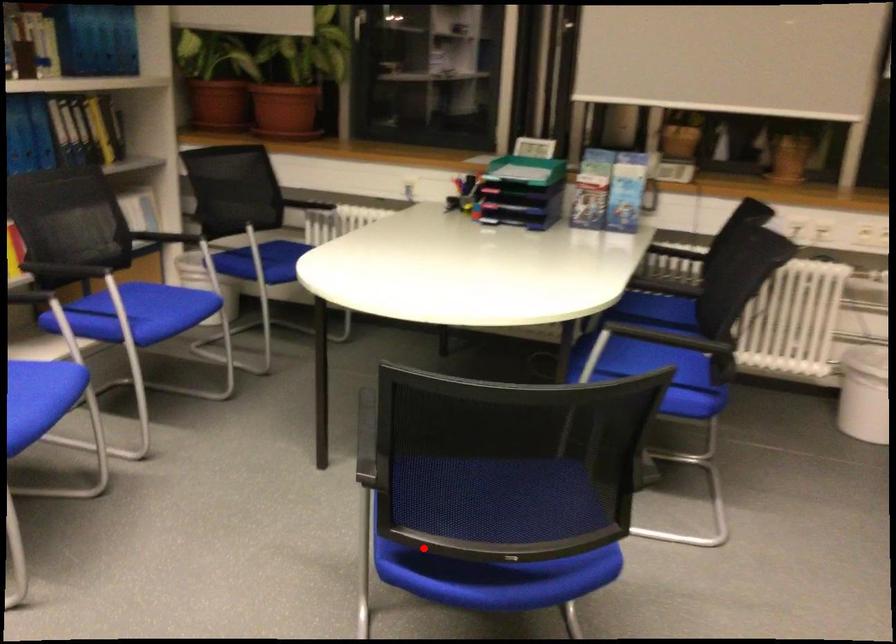
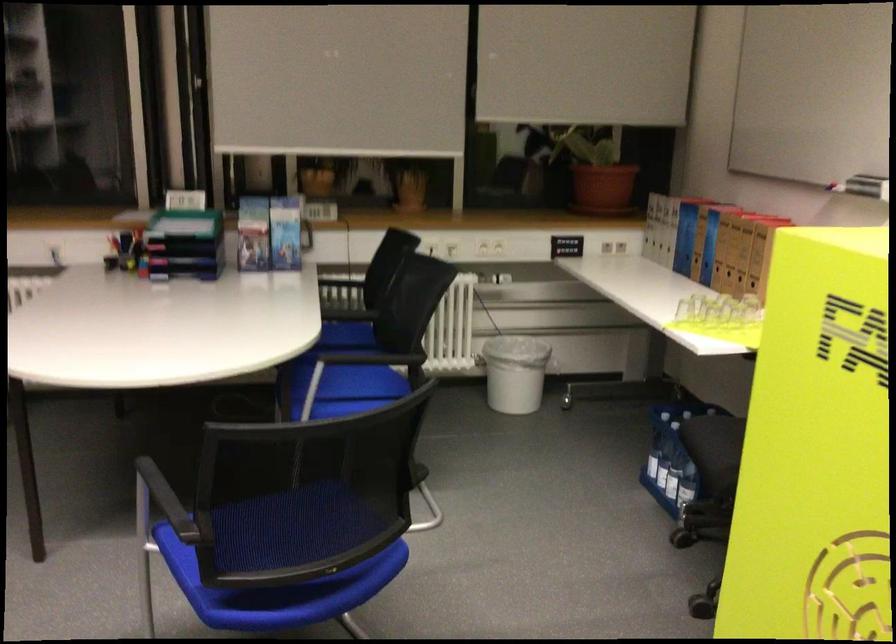
In the second image, find the point that corresponds to the highlighted location in the first image.

(261, 585)